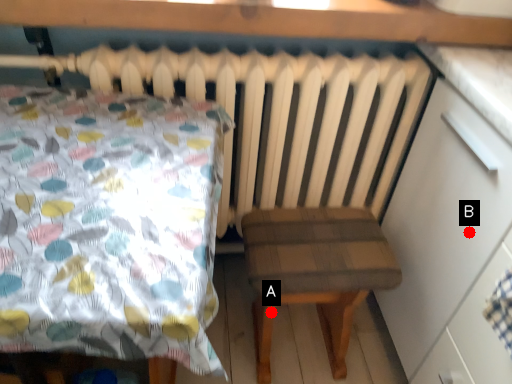
Question: Two points are circled on the image, labeled by A and B beside each circle. Which of the following is the closest to the observer?

Choices:
 (A) A is closer
 (B) B is closer

Answer: (B)